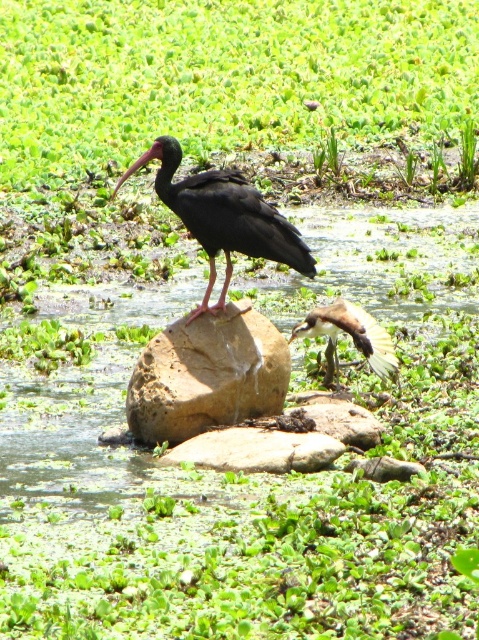
What do you see at coordinates (378, 264) in the screenshot? This screenshot has height=640, width=479. I see `clear water at rock center` at bounding box center [378, 264].

Can you confirm if clear water at rock center is smaller than brown rough rock at center?

Correct, clear water at rock center occupies less space than brown rough rock at center.

Which is behind, point (91, 305) or point (254, 346)?

The point (91, 305) is more distant.

You are a GUI agent. You are given a task and a screenshot of the screen. Output one action in this format:
    pyautogui.click(x=<x>, y=<y>)
    Task: Click on the clear water at rock center
    This screenshot has width=479, height=640.
    Given the screenshot: What is the action you would take?
    [378, 264]

Does brown rough rock at center have a smaller size compared to shiny black bird at center?

Yes, brown rough rock at center is smaller than shiny black bird at center.

Who is higher up, brown rough rock at center or shiny black bird at center?

shiny black bird at center is above.

You are a GUI agent. You are given a task and a screenshot of the screen. Output one action in this format:
    pyautogui.click(x=<x>, y=<y>)
    Task: Click on the brown rough rock at center
    Image resolution: width=479 pixels, height=640 pixels.
    Given the screenshot: What is the action you would take?
    pyautogui.click(x=207, y=376)

The width and height of the screenshot is (479, 640). Identify the location of brown rough rock at center. point(207,376).

Does shiny black bird at center have a greater width compared to brown feathered bird at center?

Yes, shiny black bird at center is wider than brown feathered bird at center.

This screenshot has width=479, height=640. What do you see at coordinates (223, 216) in the screenshot?
I see `shiny black bird at center` at bounding box center [223, 216].

Which is behind, point (260, 236) or point (388, 349)?

The point (388, 349) is more distant.

I want to click on shiny black bird at center, so point(223,216).